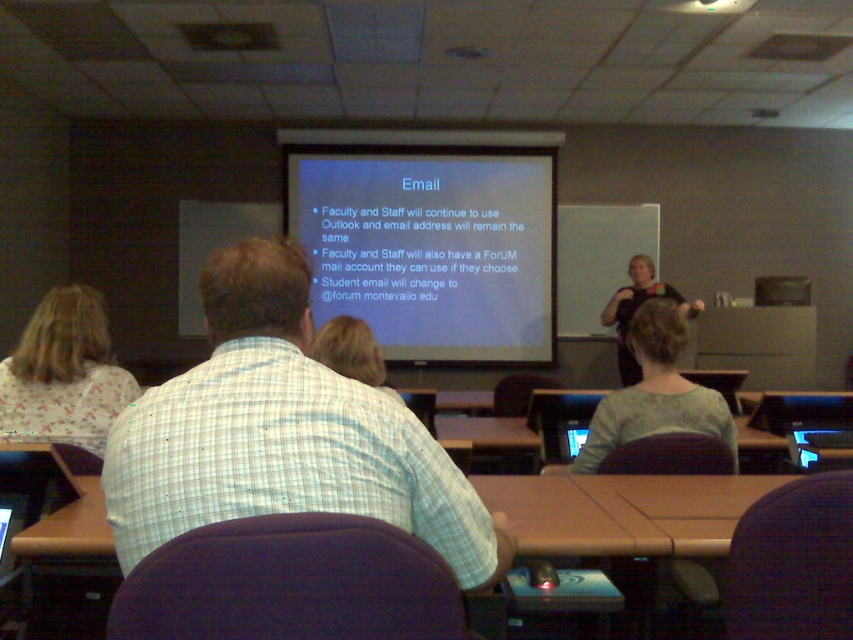
Question: Is white floral shirt at left further to camera compared to black fabric shirt at upper right?

Choices:
 (A) no
 (B) yes

Answer: (A)

Question: Can you confirm if white checkered shirt at center is wider than white matte projector screen at center?

Choices:
 (A) no
 (B) yes

Answer: (A)

Question: Which of these objects is positioned closest to the white matte projector screen at center?

Choices:
 (A) white floral shirt at left
 (B) gray fabric shirt at center
 (C) white checkered shirt at center

Answer: (B)

Question: Which is farther from the black fabric shirt at upper right?

Choices:
 (A) gray fabric shirt at center
 (B) white matte projector screen at center
 (C) brown wood table at center
 (D) white floral shirt at left

Answer: (D)

Question: Which of the following is the closest to the observer?

Choices:
 (A) (25, 540)
 (B) (430, 452)
 (C) (94, 292)
 (D) (593, 449)

Answer: (B)

Question: In this image, where is white checkered shirt at center located relative to black fabric shirt at upper right?

Choices:
 (A) below
 (B) above

Answer: (A)